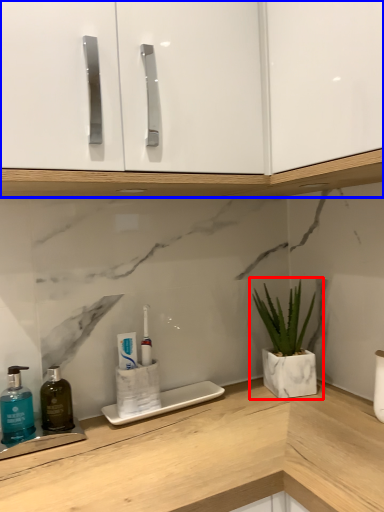
Question: Among these objects, which one is farthest to the camera, houseplant (highlighted by a red box) or cabinetry (highlighted by a blue box)?

Choices:
 (A) houseplant
 (B) cabinetry

Answer: (A)